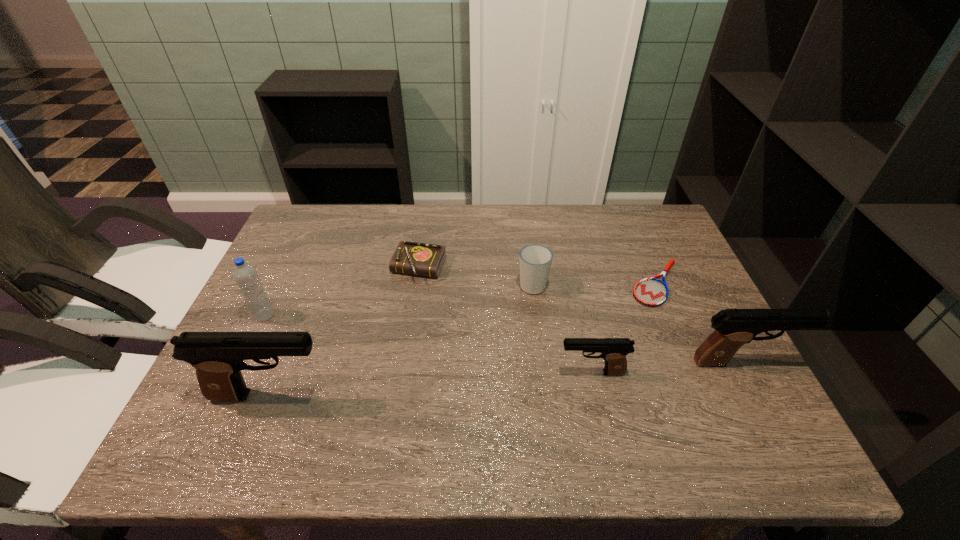
Identify the location of blank area located 0.320m at the barrel of the shortest pistol. (416, 373).

The width and height of the screenshot is (960, 540). I want to click on free space located 0.070m at the barrel of the shortest pistol, so click(527, 373).

At what (x,y) coordinates should I click in order to perform the action: click on vacant space situated 0.260m at the barrel of the shortest pistol. Please return your answer as a coordinate pair (x, y). Looking at the image, I should click on point(443,373).

At what (x,y) coordinates should I click in order to perform the action: click on vacant space situated on the front of the shortest object. Please return your answer as a coordinate pair (x, y). Looking at the image, I should click on click(x=675, y=328).

Locate an element on the screen. This screenshot has width=960, height=540. vacant space situated on the back of the water bottle is located at coordinates (283, 276).

The width and height of the screenshot is (960, 540). In order to click on blank space located 0.060m on the back of the sixth tallest object in this screenshot , I will do `click(423, 238)`.

I want to click on free space located with a handle on the side of the cup, so tap(525, 225).

I want to click on free space located 0.280m with a handle on the side of the cup, so click(x=524, y=214).

You are a GUI agent. You are given a task and a screenshot of the screen. Output one action in this format:
    pyautogui.click(x=<x>, y=<y>)
    Task: Click on the vacant region located with a handle on the side of the cup
    The height and width of the screenshot is (540, 960).
    Given the screenshot: What is the action you would take?
    pyautogui.click(x=523, y=211)

At what (x,y) coordinates should I click in order to perform the action: click on object positioned at the far edge. Please return your answer as a coordinate pair (x, y). The image size is (960, 540). Looking at the image, I should click on (421, 259).